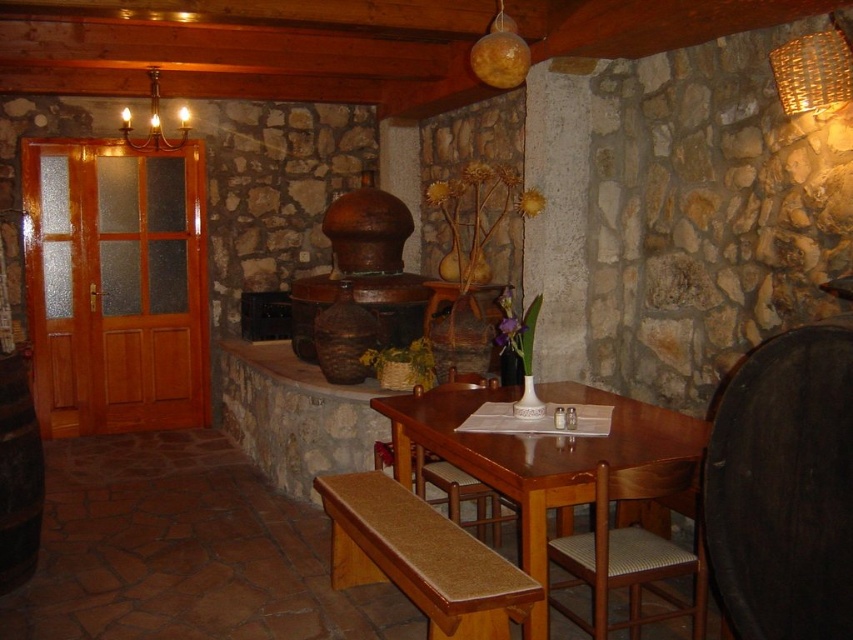
Can you confirm if brown textured bench at lower center is shorter than matte orange sphere at upper center?

Yes.

Between brown textured bench at lower center and matte orange sphere at upper center, which one has less height?

Standing shorter between the two is brown textured bench at lower center.

Between point (386, 541) and point (523, 54), which one is positioned in front?

Point (386, 541) is more forward.

Find the location of a particular element. Image resolution: width=853 pixels, height=640 pixels. brown textured bench at lower center is located at coordinates tap(421, 557).

Who is more forward, (509, 618) or (498, 536)?

Point (509, 618) is in front.

Who is shorter, brown textured bench at lower center or wooden chair at center?

brown textured bench at lower center is shorter.

What are the coordinates of `brown textured bench at lower center` in the screenshot? It's located at (421, 557).

I want to click on brown textured bench at lower center, so click(421, 557).

Which is behind, point (544, 541) or point (521, 42)?

Positioned behind is point (521, 42).

Is point (453, 438) farther from camera compared to point (515, 68)?

Yes, it is behind point (515, 68).

Between point (527, 563) and point (509, 33), which one is positioned in front?

Positioned in front is point (527, 563).

Image resolution: width=853 pixels, height=640 pixels. I want to click on wooden table at center, so click(535, 449).